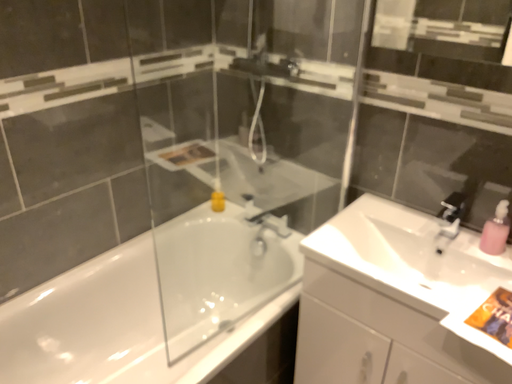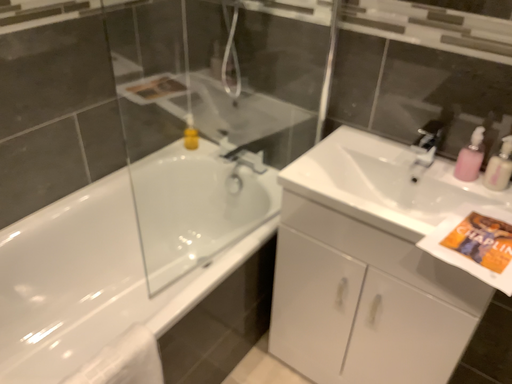
Question: Which way did the camera rotate in the video?

Choices:
 (A) rotated downward
 (B) rotated upward

Answer: (A)